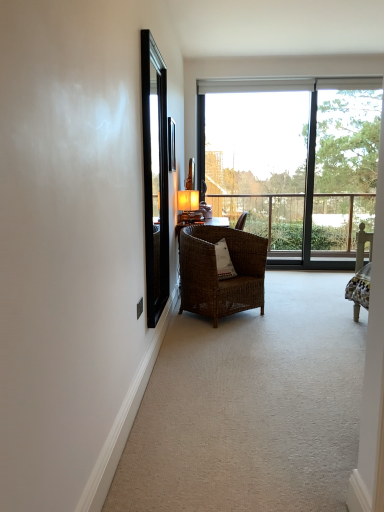
Question: Visually, is woven brown chair at center positioned to the left or to the right of transparent glass window at center?

Choices:
 (A) left
 (B) right

Answer: (A)

Question: Is point (233, 263) positioned closer to the camera than point (337, 160)?

Choices:
 (A) closer
 (B) farther

Answer: (A)

Question: Which of these objects is positioned farthest from the woven brown chair at center?

Choices:
 (A) matte gold table lamp at center
 (B) black glass screen door at left
 (C) woven wicker chair at center
 (D) transparent glass window at center

Answer: (D)

Question: Which of these objects is positioned closest to the woven brown chair at center?

Choices:
 (A) matte gold table lamp at center
 (B) black glass screen door at left
 (C) woven wicker chair at center
 (D) transparent glass window at center

Answer: (C)